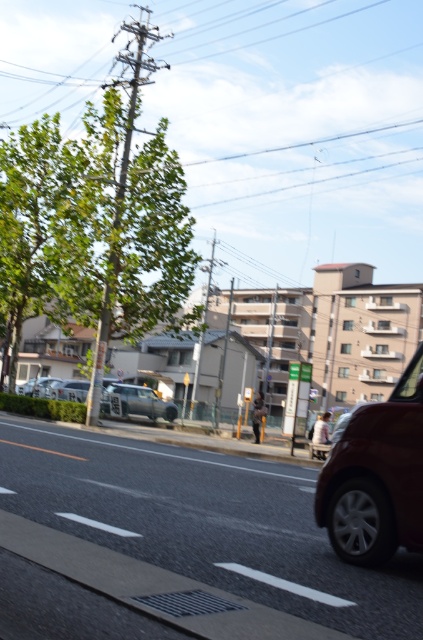
You are a delivery person who needs to load a tall package into a vehicle. You have two options in the image, the satin red car at right and the satin silver car at center. Which vehicle would allow you to load the package without tilting it, based on their heights?

The satin red car at right has a greater height compared to the satin silver car at center, so the satin red car at right would allow you to load the tall package without tilting it.

You are a delivery driver who needs to park your vehicle between the two cars in the center of the image. The space between them is exactly 1.8 meters. Your delivery van is 2 meters long. Can you safely park your van between the satin silver car at center and the silver metallic car at center without overlapping either?

The space between the satin silver car at center and the silver metallic car at center is 1.8 meters. Since your delivery van is 2 meters long, which is longer than the available space, you cannot safely park your van between them without overlapping either car.

You are a delivery driver who needs to park your vehicle in a spot that is not occupied. Based on the scene, can you determine if the satin red car at right is blocking the parking space directly to its left?

The satin red car at right is located at point (376,477), which does not provide information about whether it is blocking the parking space to its left. Therefore, it is unclear if the parking space is available.